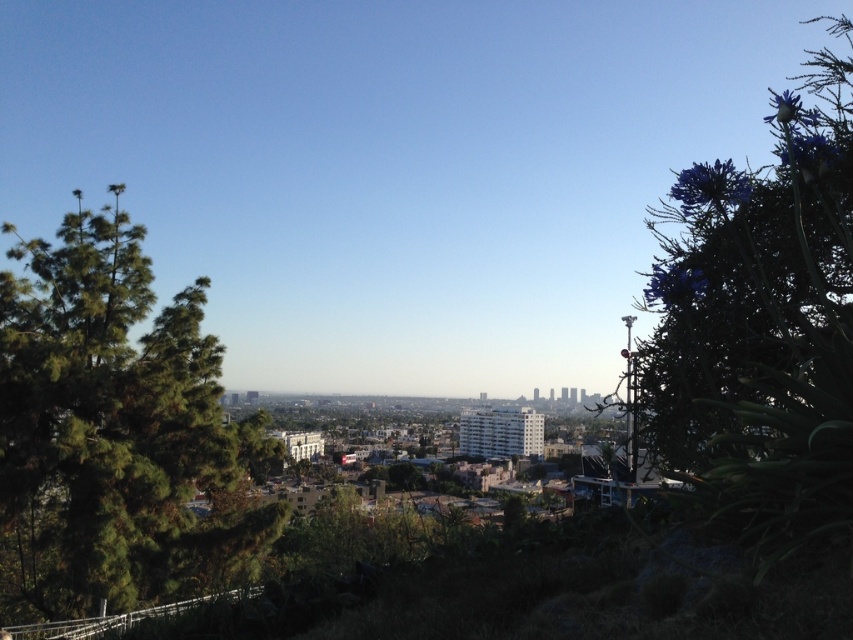
Question: Which point appears closest to the camera in this image?

Choices:
 (A) pos(73,612)
 (B) pos(761,486)

Answer: (B)

Question: Does green leafy tree at left come in front of purple leafy plant at right?

Choices:
 (A) no
 (B) yes

Answer: (A)

Question: Can you confirm if green leafy tree at left is positioned below purple leafy plant at right?

Choices:
 (A) yes
 (B) no

Answer: (A)

Question: Among these points, which one is farthest from the camera?

Choices:
 (A) (784, 284)
 (B) (10, 474)

Answer: (A)

Question: Does green leafy tree at left appear under purple leafy plant at right?

Choices:
 (A) yes
 (B) no

Answer: (A)